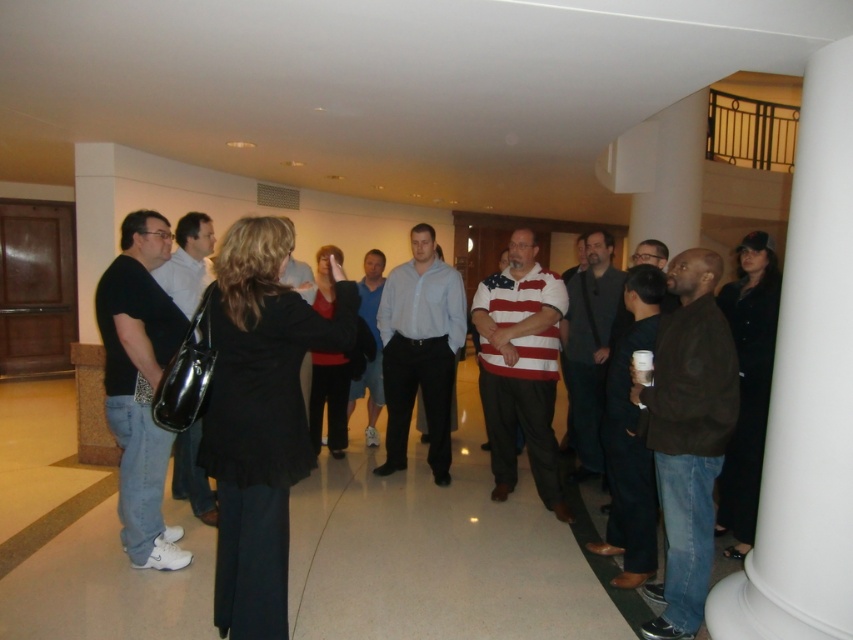
Based on the photo, you are a photographer setting up for a group photo. You want to ensure both the black matte blazer at center and the brown suede jacket at lower right are clearly visible in the shot. Considering their positions, which one should you focus on first to ensure depth of field captures both?

You should focus on the black matte blazer at center first because it is closer to the viewer than the brown suede jacket at lower right. By focusing on the closer object, the depth of field will extend backward, increasing the likelihood that both will be in focus.

You are a tailor who needs to measure the space between two garments. You see the black matte blazer at center and the brown suede jacket at lower right. Can you fit a 3.5 feet long measuring tape between them without moving the garments?

The distance between the black matte blazer at center and the brown suede jacket at lower right is 4.15 feet. Since the measuring tape is 3.5 feet long, it can easily fit within the available space without needing to move the garments.

You are a tailor measuring garments for alterations. You have a customer who wants to know if their black matte blazer at center can fit over their matte white shirt at center. Based on the image, can the blazer accommodate the shirt without issues?

The black matte blazer at center is not as tall as the matte white shirt at center, so the blazer may be too short to properly cover the shirt. The customer should consider alterations to ensure a proper fit.